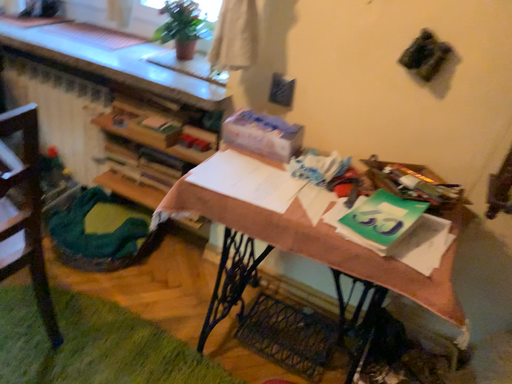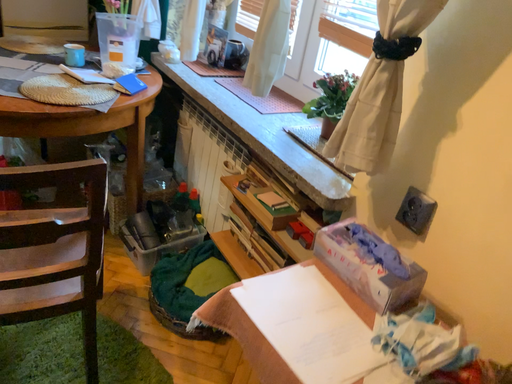
Question: How did the camera likely rotate when shooting the video?

Choices:
 (A) rotated downward
 (B) rotated upward

Answer: (B)